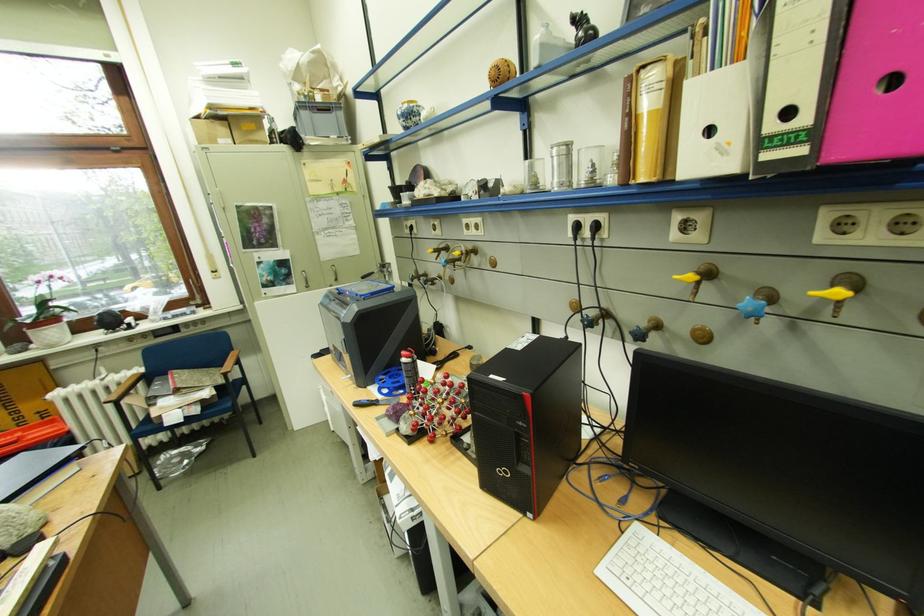
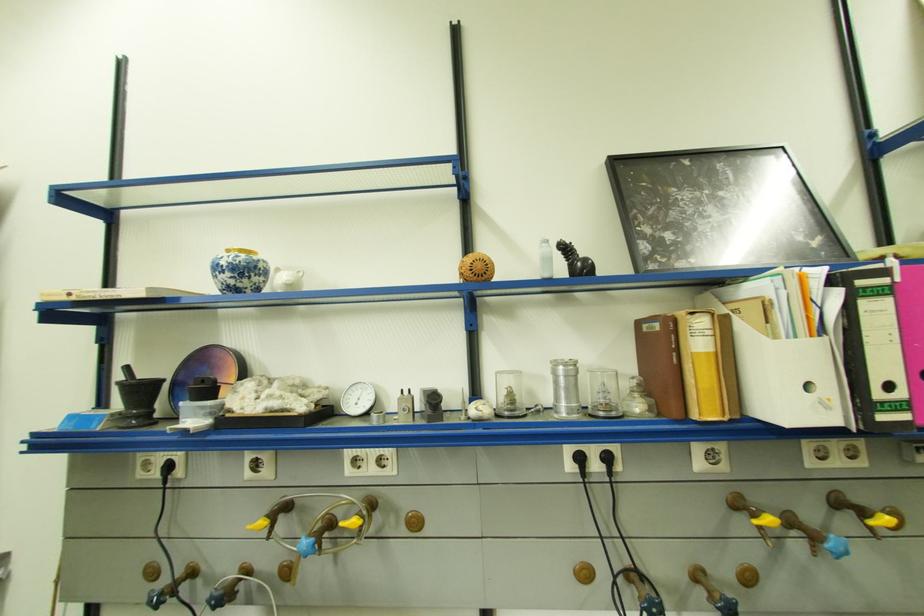
The first image is from the beginning of the video and the second image is from the end. How did the camera likely rotate when shooting the video?

The camera's rotation is toward right-up.